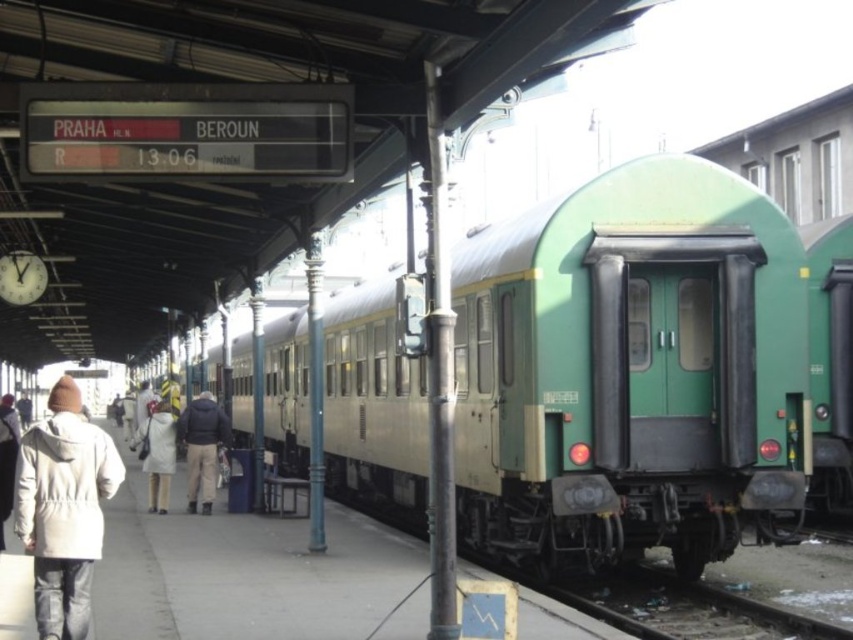
Question: Can you confirm if white matte coat at lower left is positioned below white woolen hat at upper left?

Choices:
 (A) yes
 (B) no

Answer: (A)

Question: Can you confirm if white matte coat at lower left is positioned above white woolen hat at upper left?

Choices:
 (A) no
 (B) yes

Answer: (A)

Question: Which object is positioned closest to the metal/rough train track at lower right?

Choices:
 (A) white woolen hat at upper left
 (B) white matte coat at left
 (C) dark blue jacket at center
 (D) white matte coat at lower left

Answer: (B)

Question: Can you confirm if green matte train car at center is thinner than dark blue jacket at center?

Choices:
 (A) yes
 (B) no

Answer: (B)

Question: Which point appears farthest from the camera in this image?

Choices:
 (A) (3, 502)
 (B) (680, 620)
 (C) (167, 474)

Answer: (C)

Question: Which point appears closest to the camera in this image?

Choices:
 (A) (595, 516)
 (B) (0, 493)

Answer: (B)